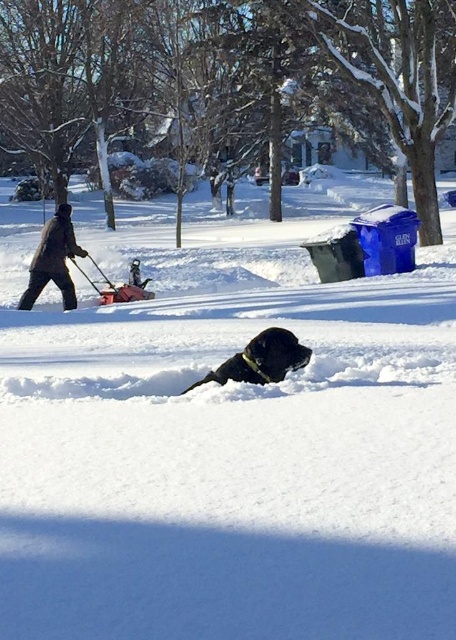
Is white fluffy snow at center behind dark brown jacket at left?

No.

Does point (367, 586) lie behind point (79, 250)?

No, it is in front of (79, 250).

Where is `white fluffy snow at center`? The width and height of the screenshot is (456, 640). white fluffy snow at center is located at coordinates (227, 433).

Which is more to the right, white fluffy snow at center or black matte dog at center?

From the viewer's perspective, black matte dog at center appears more on the right side.

Can you confirm if white fluffy snow at center is thinner than black matte dog at center?

Incorrect, white fluffy snow at center's width is not less than black matte dog at center's.

Where is `white fluffy snow at center`? The image size is (456, 640). white fluffy snow at center is located at coordinates (227, 433).

Locate an element on the screen. The height and width of the screenshot is (640, 456). white fluffy snow at center is located at coordinates click(227, 433).

Between black matte dog at center and dark brown jacket at left, which one appears on the right side from the viewer's perspective?

black matte dog at center is more to the right.

I want to click on black matte dog at center, so click(262, 358).

Image resolution: width=456 pixels, height=640 pixels. I want to click on black matte dog at center, so click(x=262, y=358).